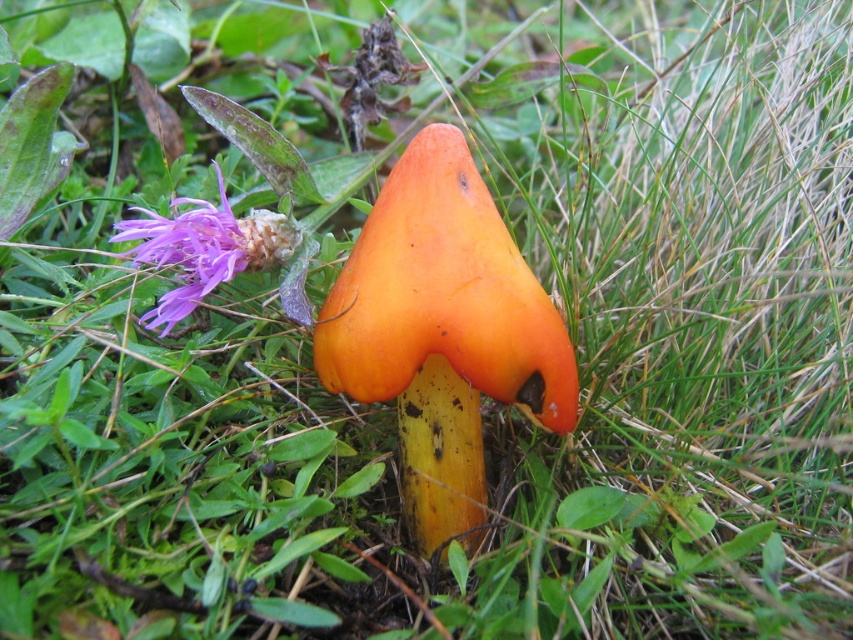
Is orange matte mushroom at center below orange matte mushroom at upper left?

Yes.

Which is behind, point (439, 220) or point (247, 248)?

The point (247, 248) is more distant.

This screenshot has height=640, width=853. Describe the element at coordinates (444, 332) in the screenshot. I see `orange matte mushroom at center` at that location.

The width and height of the screenshot is (853, 640). I want to click on orange matte mushroom at center, so click(444, 332).